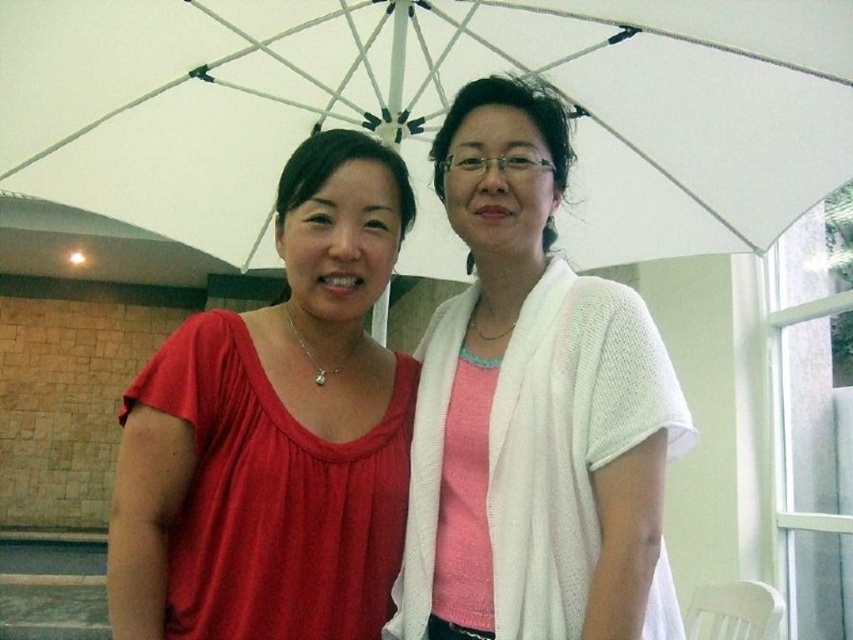
Question: Which is nearer to the white fabric umbrella at upper center?

Choices:
 (A) white knitted sweater at center
 (B) matte red blouse at center

Answer: (A)

Question: Does white fabric umbrella at upper center appear on the left side of white knitted sweater at center?

Choices:
 (A) no
 (B) yes

Answer: (B)

Question: Is the position of white fabric umbrella at upper center less distant than that of matte red blouse at center?

Choices:
 (A) yes
 (B) no

Answer: (B)

Question: Does white fabric umbrella at upper center lie behind matte red blouse at center?

Choices:
 (A) no
 (B) yes

Answer: (B)

Question: Which object is farther from the camera taking this photo?

Choices:
 (A) matte red blouse at center
 (B) white knitted sweater at center
 (C) white fabric umbrella at upper center

Answer: (C)

Question: Which object appears farthest from the camera in this image?

Choices:
 (A) matte red blouse at center
 (B) white fabric umbrella at upper center

Answer: (B)